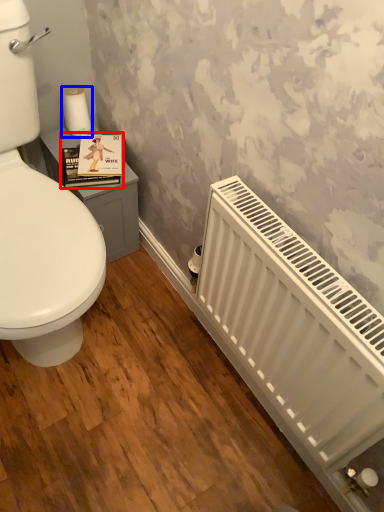
Question: Which of the following is the farthest to the observer, book cover (highlighted by a red box) or toilet paper (highlighted by a blue box)?

Choices:
 (A) book cover
 (B) toilet paper

Answer: (B)